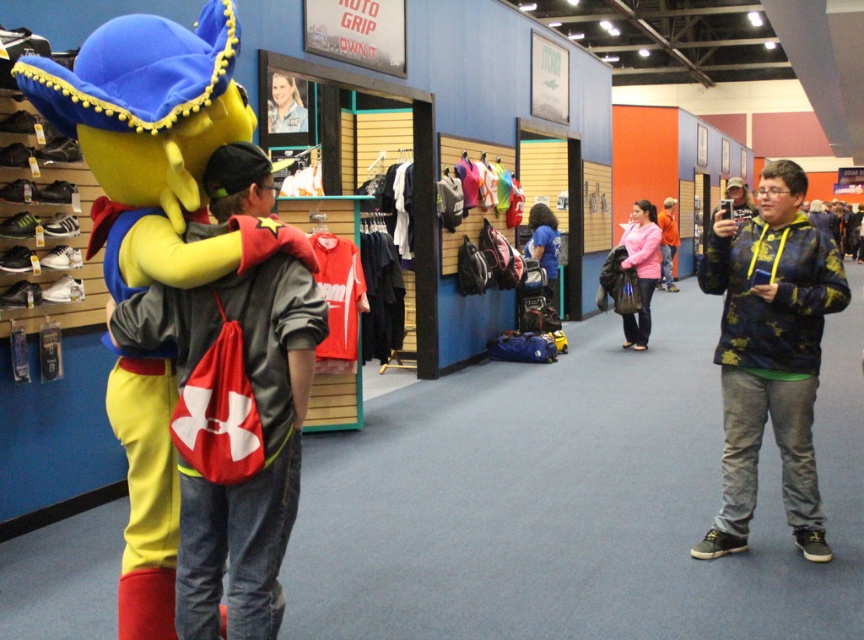
Question: Is matte red jersey at center below pink matte jacket at center?

Choices:
 (A) yes
 (B) no

Answer: (A)

Question: Which of the following is the closest to the observer?

Choices:
 (A) (233, 632)
 (B) (551, 227)

Answer: (A)

Question: Can you confirm if floral-patterned hoodie at right is positioned below matte red jersey at center?

Choices:
 (A) no
 (B) yes

Answer: (B)

Question: Considering the real-world distances, which object is farthest from the floral-patterned hoodie at right?

Choices:
 (A) pink matte jacket at center
 (B) orange matte jacket at center
 (C) matte red jersey at center

Answer: (B)

Question: Which point is closer to the camera taking this photo?

Choices:
 (A) (642, 337)
 (B) (812, 460)
 (C) (665, 224)

Answer: (B)

Question: Can you confirm if pink matte jacket at center is thinner than blue t-shirt at center?

Choices:
 (A) no
 (B) yes

Answer: (B)